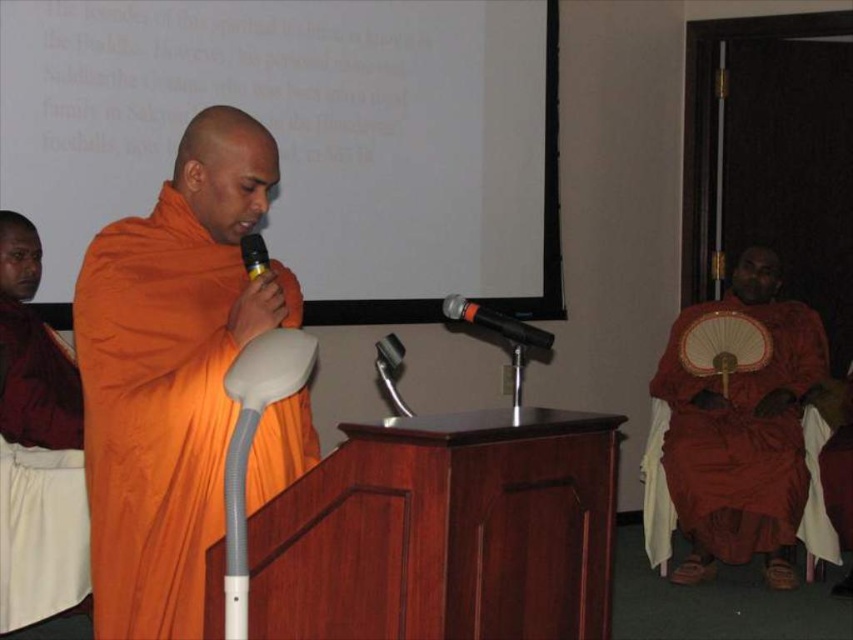
Which is above, matte orange robe at right or orange silk robe at left?

orange silk robe at left

Can you confirm if matte orange robe at right is positioned above orange silk robe at left?

Incorrect, matte orange robe at right is not positioned above orange silk robe at left.

Who is more forward, (770, 515) or (67, 412)?

Point (67, 412)

You are a GUI agent. You are given a task and a screenshot of the screen. Output one action in this format:
    pyautogui.click(x=<x>, y=<y>)
    Task: Click on the matte orange robe at right
    The width and height of the screenshot is (853, 640).
    Given the screenshot: What is the action you would take?
    pyautogui.click(x=738, y=445)

Does matte orange robe at right have a smaller size compared to black metallic microphone at center?

No.

Does point (646, 451) lie in front of point (474, 305)?

No, (646, 451) is behind (474, 305).

Find the location of a particular element. matte orange robe at right is located at coordinates (738, 445).

Between orange silk robe at center and orange silk robe at left, which one appears on the left side from the viewer's perspective?

orange silk robe at left is more to the left.

Which of these two, orange silk robe at center or orange silk robe at left, stands shorter?

orange silk robe at left

Image resolution: width=853 pixels, height=640 pixels. What are the coordinates of `orange silk robe at center` in the screenshot? It's located at (155, 413).